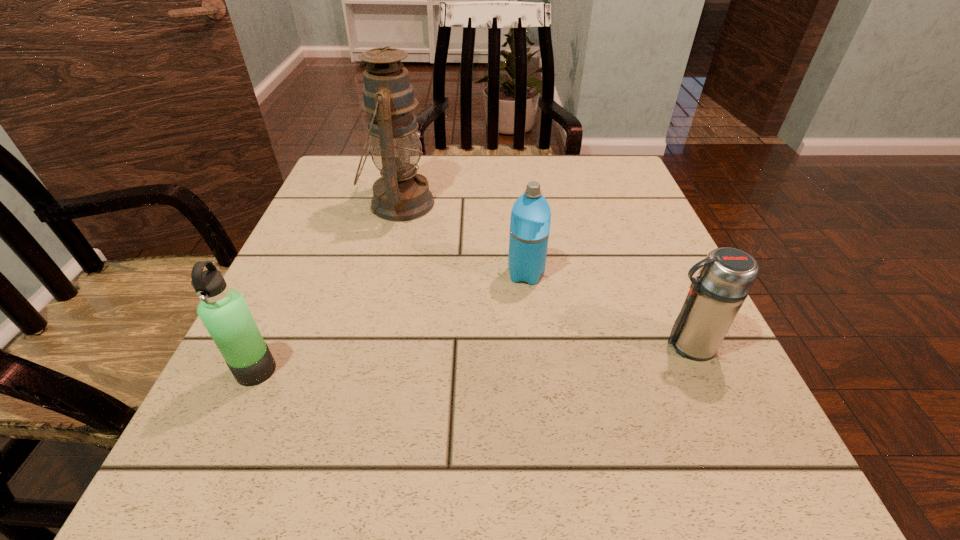
Locate an element on the screen. The height and width of the screenshot is (540, 960). free location that satisfies the following two spatial constraints: 1. on the back side of the second farthest object; 2. on the left side of the leftmost object is located at coordinates (300, 274).